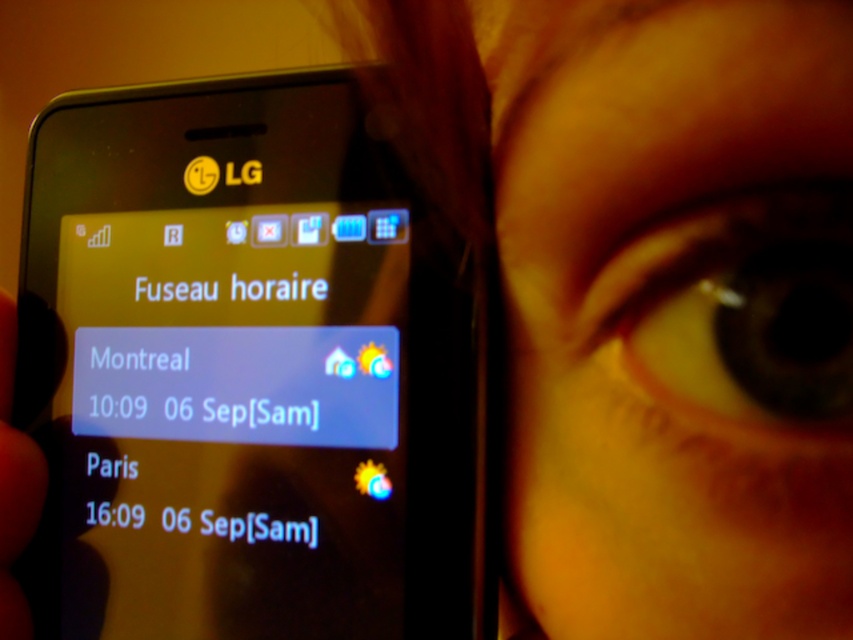
You are taking a photo of the smartphone screen and notice two points marked on it. Which point, point (637,442) or point (242,294), appears closer to your camera lens?

Point (637,442) is closer to the camera than point (242,294).

You are a photographer reviewing a portrait photo. The image has a yellow skin at center and a black matte text at upper center. Based on their sizes, which element would appear more prominent to the viewer?

The black matte text at upper center appears more prominent because it is thicker than the yellow skin at center.

You are a photographer trying to capture the exact center of the yellow skin at center in the image. According to the coordinates provided, where should you aim your camera?

The exact center of the yellow skin at center is located at the coordinates point (x=653, y=300).